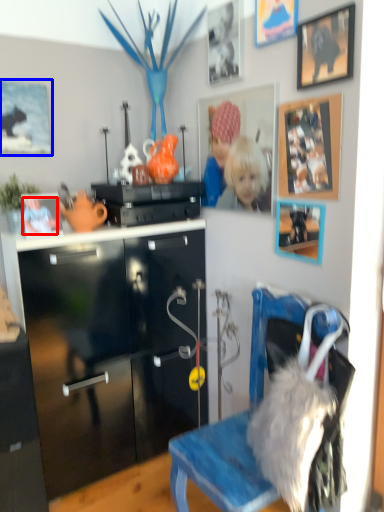
Question: Which object is further to the camera taking this photo, person (highlighted by a red box) or picture frame (highlighted by a blue box)?

Choices:
 (A) person
 (B) picture frame

Answer: (B)